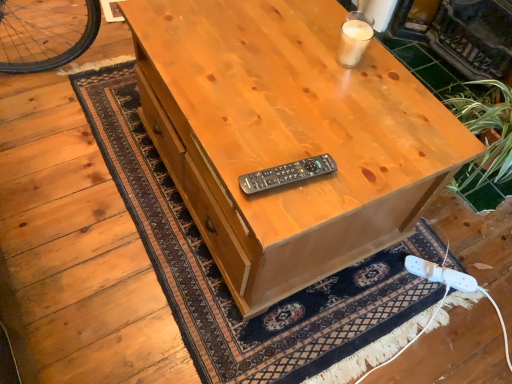
In order to click on vacant area that lies between natural wood desk at center and white plastic game controller at lower right in this screenshot , I will do `click(382, 282)`.